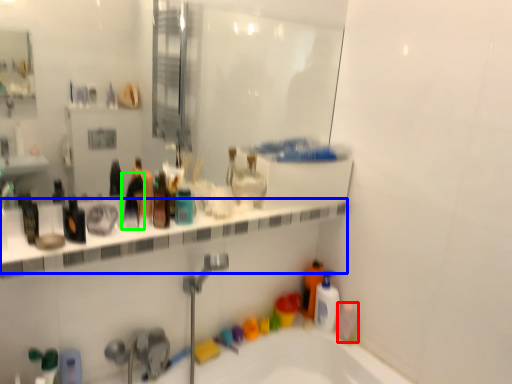
Question: Estimate the real-world distances between objects in this image. Which object is farther from mouthwash (highlighted by a red box), ledge (highlighted by a blue box) or toiletry (highlighted by a green box)?

Choices:
 (A) ledge
 (B) toiletry

Answer: (B)